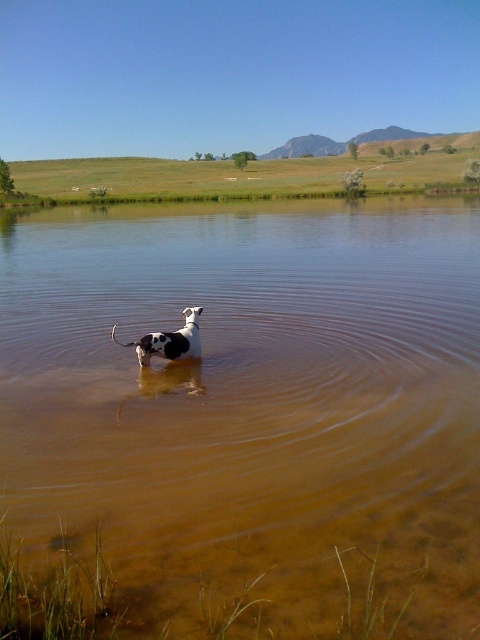
Question: Is brown translucent water at center below black and white spotted dog at center?

Choices:
 (A) no
 (B) yes

Answer: (A)

Question: Which object is closer to the camera taking this photo?

Choices:
 (A) brown translucent water at center
 (B) black and white spotted dog at center

Answer: (A)

Question: Does brown translucent water at center have a smaller size compared to black and white spotted dog at center?

Choices:
 (A) yes
 (B) no

Answer: (B)

Question: Does brown translucent water at center have a smaller size compared to black and white spotted dog at center?

Choices:
 (A) yes
 (B) no

Answer: (B)

Question: Which object appears farthest from the camera in this image?

Choices:
 (A) brown translucent water at center
 (B) black and white spotted dog at center

Answer: (B)